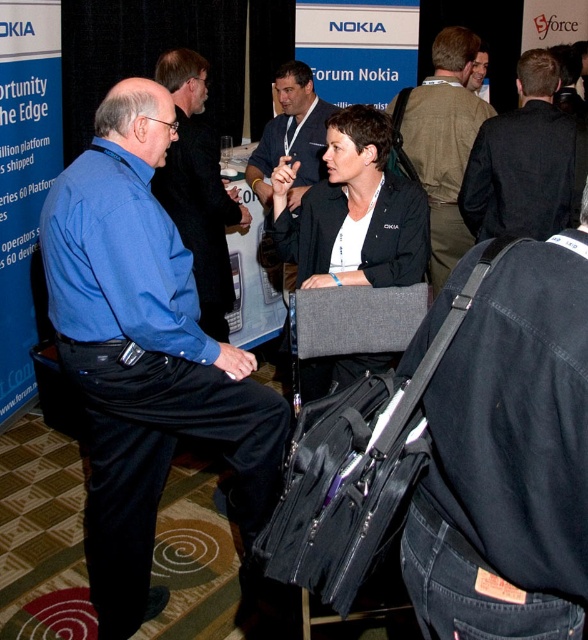
You are a photographer at the event and need to capture a photo of both the blue cotton shirt at left and the black fabric chair at center in the same frame. The camera you are using has a maximum focus range of 30 inches. Can you take the photo without moving either object?

The blue cotton shirt at left is 31.90 inches away from the black fabric chair at center. Since the distance exceeds the camera maximum focus range of 30 inches, you cannot take the photo without moving either object.

Consider the image. You are a photographer at the event and want to capture a photo of the black denim shirt at center. The camera you are using has a minimum focusing distance of 30 inches. Will you be able to take the photo without moving closer?

The black denim shirt at center is 32.39 inches away, which is beyond the camera minimum focusing distance of 30 inches. Therefore, you can take the photo without moving closer.

You are standing at the event and want to take a photo of the black fabric chair at center. If your camera can focus clearly on objects within 2 meters, will you need to step closer to ensure the chair is in focus?

The black fabric chair at center is 2.28 meters away from the camera. Since the camera focuses clearly within 2 meters, you need to step closer to ensure the chair is in focus.